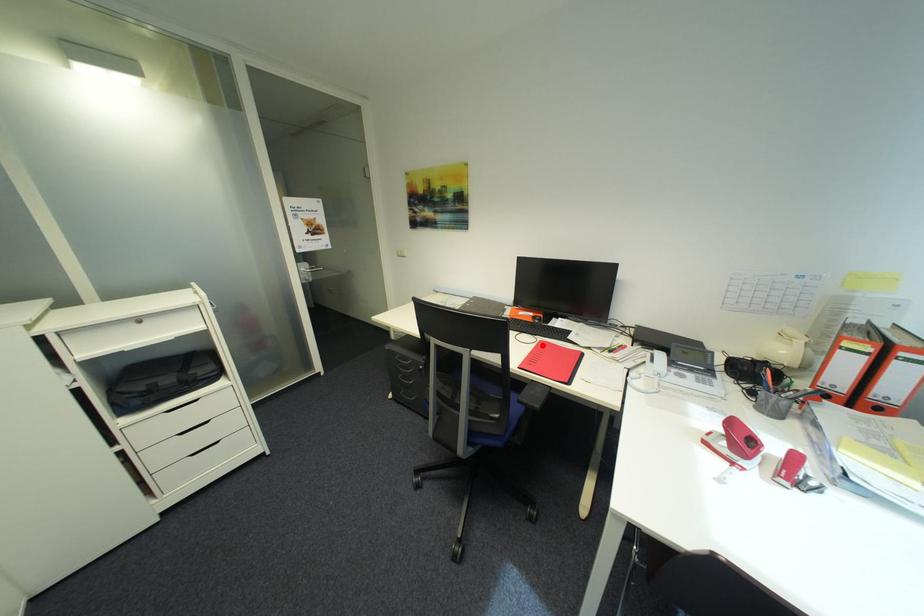
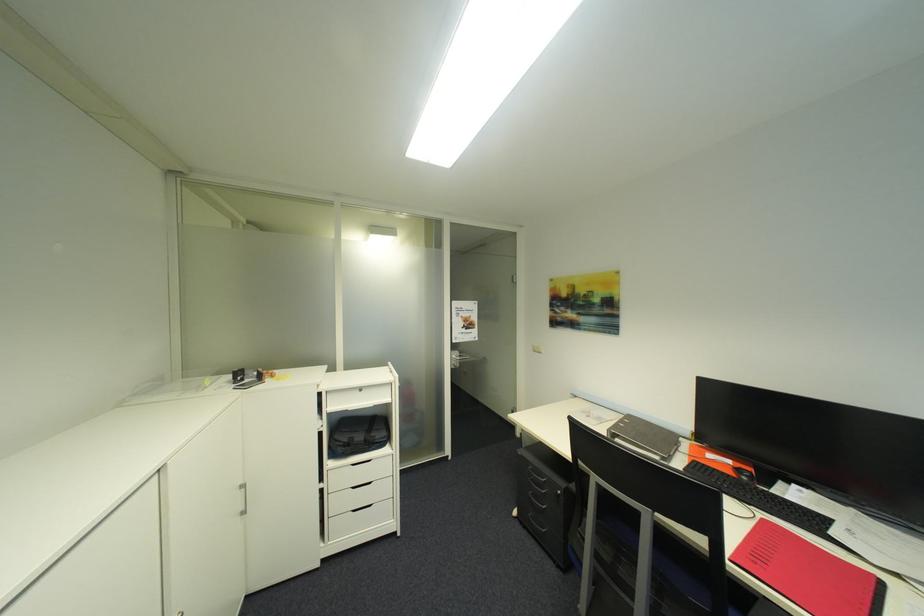
Find the pixel in the second image that matches the highlighted location in the first image.

(760, 524)